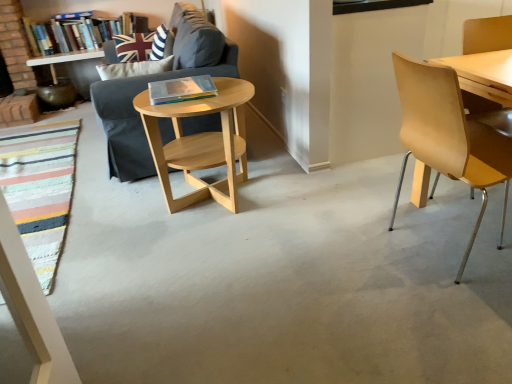
What are the coordinates of `vacant space that is to the left of light wood/woodenobject at center` in the screenshot? It's located at (113, 214).